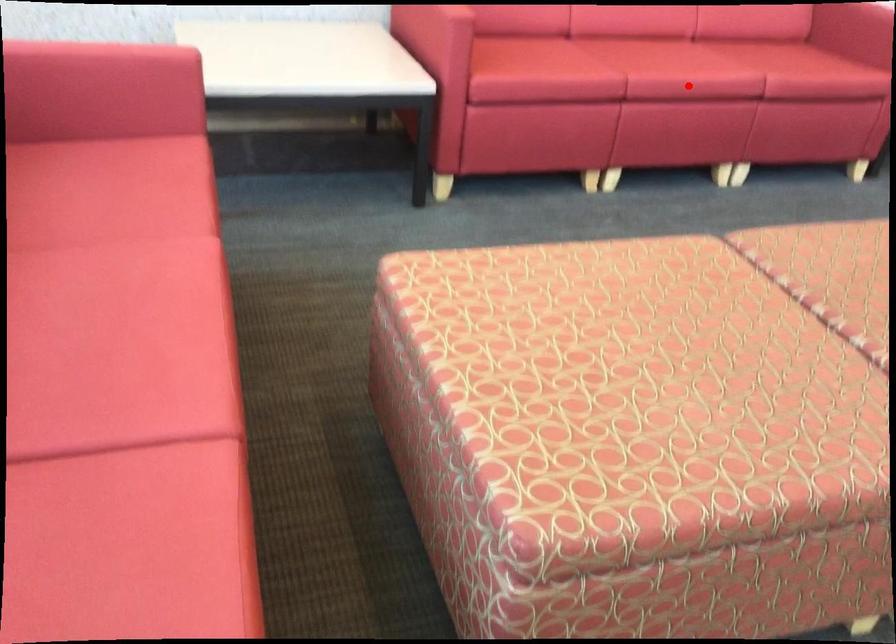
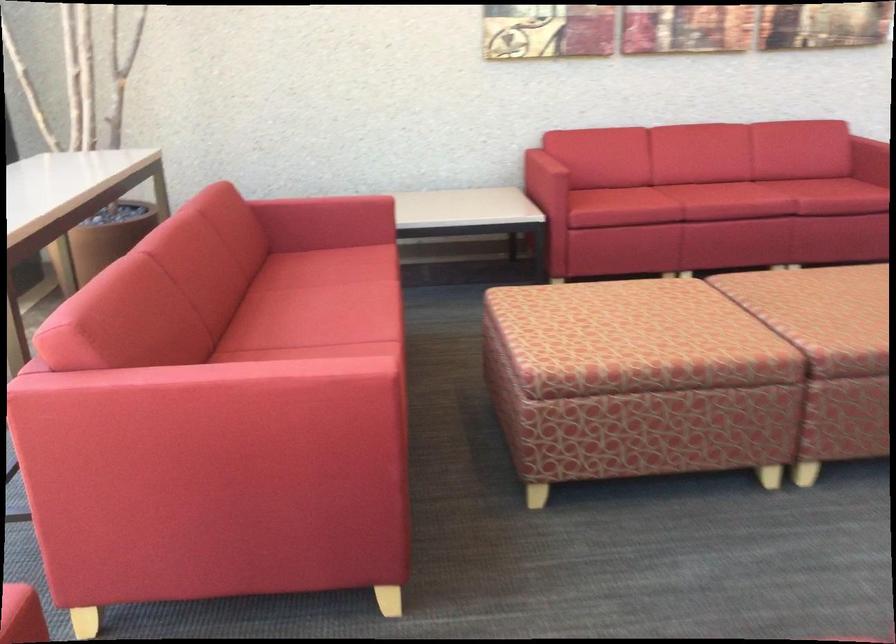
In the second image, find the point that corresponds to the highlighted location in the first image.

(725, 201)